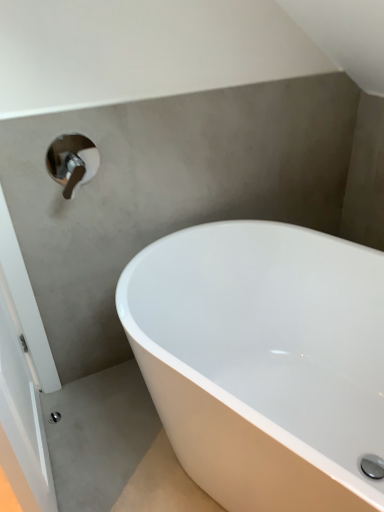
Question: Can you confirm if satin nickel faucet at upper left is bigger than white glossy bathtub at lower right?

Choices:
 (A) no
 (B) yes

Answer: (A)

Question: Are satin nickel faucet at upper left and white glossy bathtub at lower right far apart?

Choices:
 (A) yes
 (B) no

Answer: (B)

Question: Is satin nickel faucet at upper left not within white glossy bathtub at lower right?

Choices:
 (A) no
 (B) yes

Answer: (B)

Question: Can you confirm if satin nickel faucet at upper left is taller than white glossy bathtub at lower right?

Choices:
 (A) no
 (B) yes

Answer: (A)

Question: From the image's perspective, would you say satin nickel faucet at upper left is positioned over white glossy bathtub at lower right?

Choices:
 (A) no
 (B) yes

Answer: (B)

Question: Is satin nickel faucet at upper left looking in the opposite direction of white glossy bathtub at lower right?

Choices:
 (A) yes
 (B) no

Answer: (B)

Question: Is white glossy bathtub at lower right at the left side of satin nickel faucet at upper left?

Choices:
 (A) no
 (B) yes

Answer: (A)

Question: Does white glossy bathtub at lower right have a greater height compared to satin nickel faucet at upper left?

Choices:
 (A) no
 (B) yes

Answer: (B)

Question: Is white glossy bathtub at lower right aimed at satin nickel faucet at upper left?

Choices:
 (A) yes
 (B) no

Answer: (B)

Question: Is white glossy bathtub at lower right further to camera compared to satin nickel faucet at upper left?

Choices:
 (A) yes
 (B) no

Answer: (B)

Question: Is white glossy bathtub at lower right at the right side of satin nickel faucet at upper left?

Choices:
 (A) yes
 (B) no

Answer: (A)

Question: From the image's perspective, is white glossy bathtub at lower right below satin nickel faucet at upper left?

Choices:
 (A) yes
 (B) no

Answer: (A)

Question: Would you say white glossy bathtub at lower right is to the left or to the right of satin nickel faucet at upper left in the picture?

Choices:
 (A) right
 (B) left

Answer: (A)